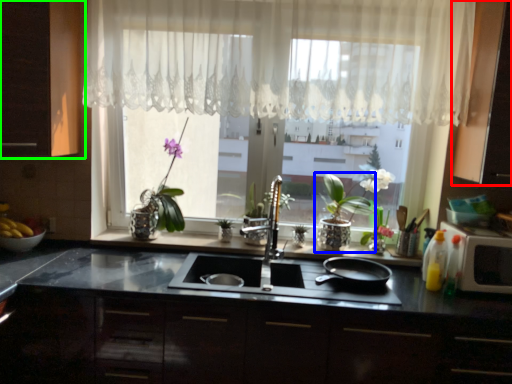
Question: Estimate the real-world distances between objects in this image. Which object is closer to cabinetry (highlighted by a red box), houseplant (highlighted by a blue box) or cabinetry (highlighted by a green box)?

Choices:
 (A) houseplant
 (B) cabinetry

Answer: (A)